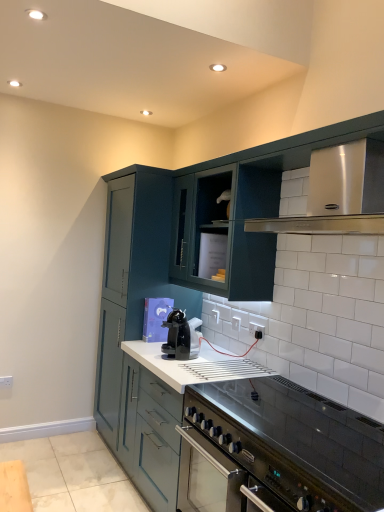
At what (x,y) coordinates should I click in order to perform the action: click on vacant region below black glossy coffee machine at center (from a real-world perspective). Please return your answer as a coordinate pair (x, y). This screenshot has width=384, height=512. Looking at the image, I should click on (182, 359).